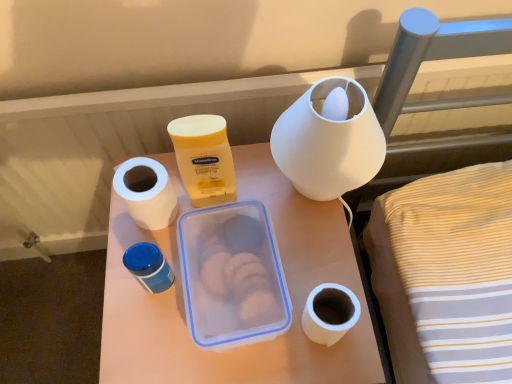
Question: Does white matte lampshade at upper center, arranged as the second pottery when viewed from the left, come in front of yellow matte lotion at center?

Choices:
 (A) yes
 (B) no

Answer: (A)

Question: From a real-world perspective, is white matte lampshade at upper center, arranged as the second pottery when viewed from the left, beneath yellow matte lotion at center?

Choices:
 (A) yes
 (B) no

Answer: (B)

Question: Can you see white matte lampshade at upper center, arranged as the 1th pottery when viewed from the right, touching yellow matte lotion at center?

Choices:
 (A) yes
 (B) no

Answer: (B)

Question: Is white matte lampshade at upper center, which is counted as the 2th pottery, starting from the bottom, thinner than yellow matte lotion at center?

Choices:
 (A) no
 (B) yes

Answer: (A)

Question: Is white matte lampshade at upper center, the first pottery viewed from the top, wider than yellow matte lotion at center?

Choices:
 (A) no
 (B) yes

Answer: (B)

Question: Is white matte lampshade at upper center, which is counted as the 2th pottery, starting from the bottom, shorter than yellow matte lotion at center?

Choices:
 (A) no
 (B) yes

Answer: (A)

Question: Does white matte toilet paper at lower right have a larger size compared to blue plastic container at center-left, which is counted as the first pottery, starting from the left?

Choices:
 (A) no
 (B) yes

Answer: (B)

Question: Is white matte toilet paper at lower right completely or partially outside of blue plastic container at center-left, which is counted as the first pottery, starting from the left?

Choices:
 (A) yes
 (B) no

Answer: (A)

Question: Is the surface of white matte toilet paper at lower right in direct contact with blue plastic container at center-left, which appears as the 2th pottery when viewed from the right?

Choices:
 (A) no
 (B) yes

Answer: (A)

Question: Does white matte toilet paper at lower right have a smaller size compared to blue plastic container at center-left, which appears as the 2th pottery when viewed from the right?

Choices:
 (A) yes
 (B) no

Answer: (B)

Question: Is white matte toilet paper at lower right positioned before blue plastic container at center-left, which is the 1th pottery from bottom to top?

Choices:
 (A) no
 (B) yes

Answer: (B)

Question: Does white matte toilet paper at lower right have a lesser width compared to blue plastic container at center-left, the second pottery viewed from the top?

Choices:
 (A) yes
 (B) no

Answer: (B)

Question: Would you say yellow matte lotion at center contains blue plastic container at center-left, which appears as the 2th pottery when viewed from the right?

Choices:
 (A) yes
 (B) no

Answer: (B)